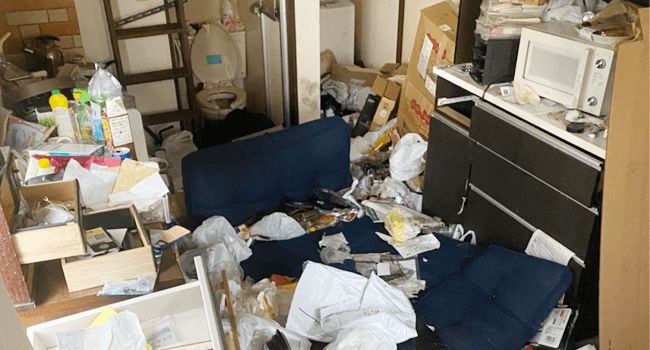
The image size is (650, 350). What are the coordinates of `plate` in the screenshot? It's located at (604, 33).